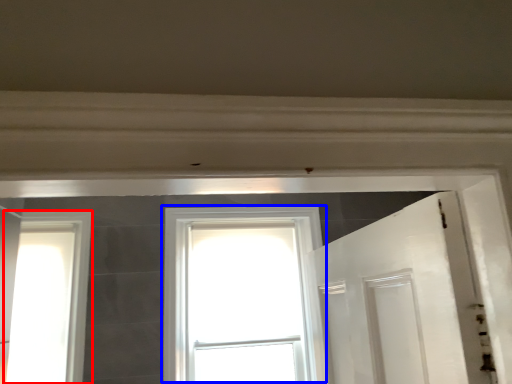
Question: Which of the following is the closest to the observer, window (highlighted by a red box) or window (highlighted by a blue box)?

Choices:
 (A) window
 (B) window

Answer: (A)